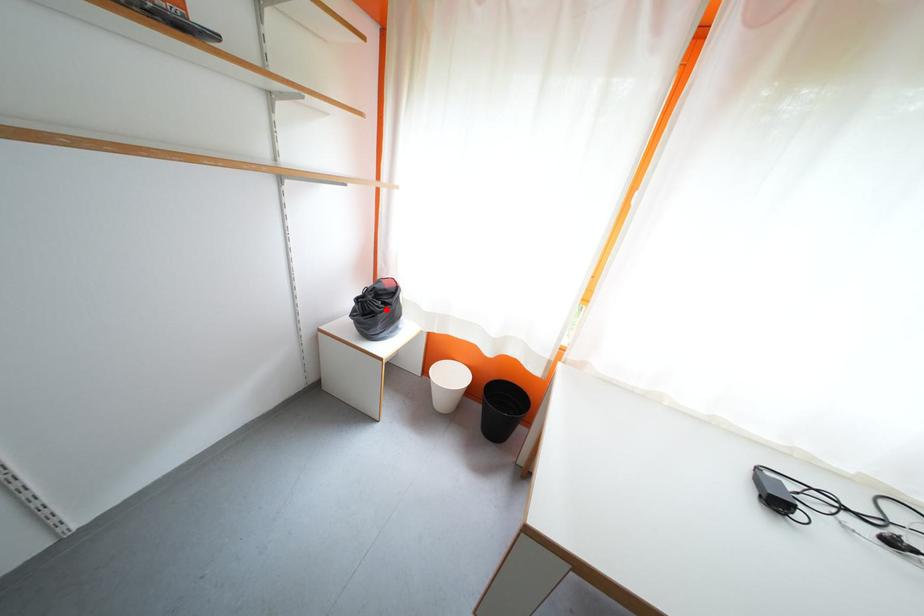
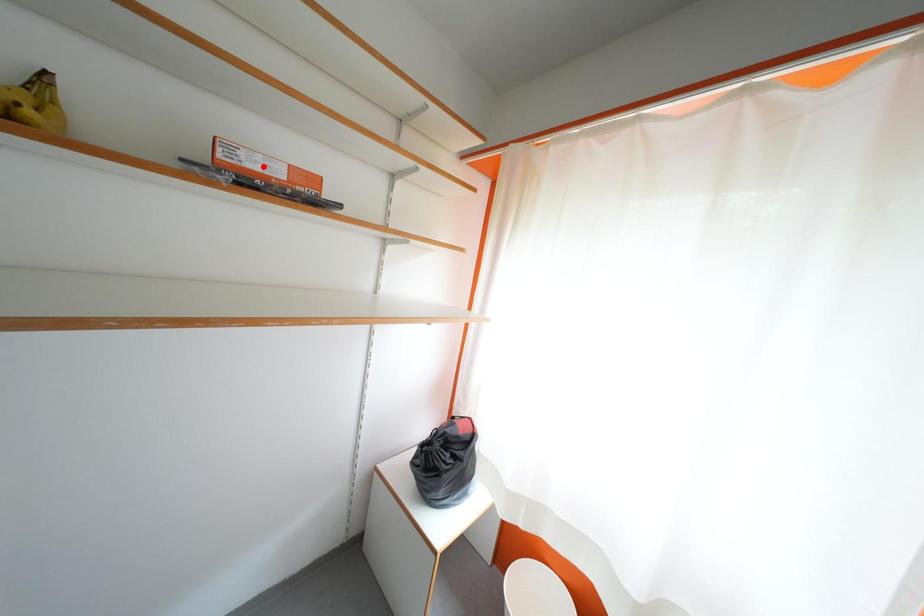
I am providing you with two images of the same scene from different viewpoints. A red point is marked on the first image and another point is marked on the second image. Is the marked point in image1 the same physical position as the marked point in image2?

No